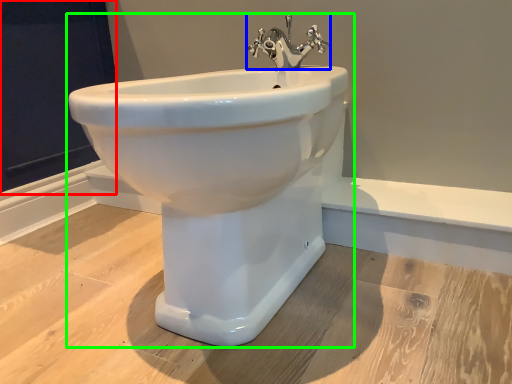
Question: Which object is the closest to the screen door (highlighted by a red box)? Choose among these: tap (highlighted by a blue box) or sink (highlighted by a green box).

Choices:
 (A) tap
 (B) sink

Answer: (A)